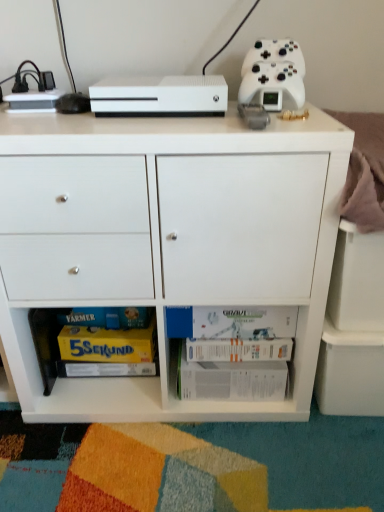
The image size is (384, 512). Find the location of `vacant space situated on the left part of white paper book at lower center, the 2th book in the top-to-bottom sequence`. vacant space situated on the left part of white paper book at lower center, the 2th book in the top-to-bottom sequence is located at coordinates (146, 428).